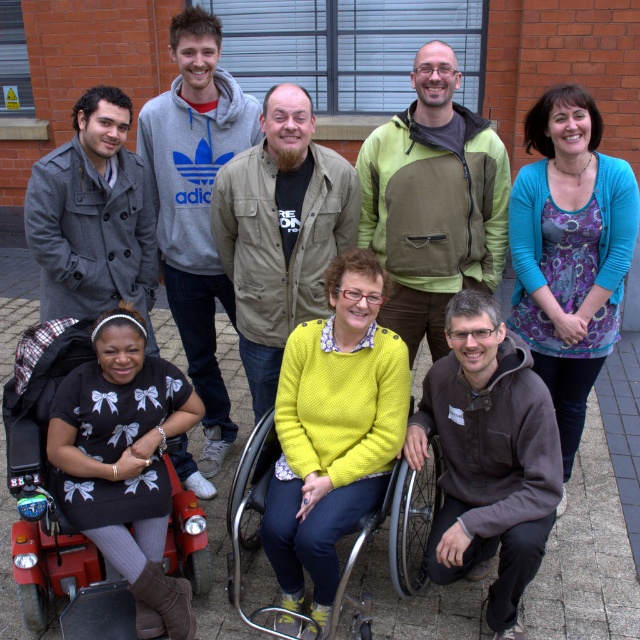
Question: Can you confirm if brown fleece at lower right is positioned below gray woolen coat at left?

Choices:
 (A) no
 (B) yes

Answer: (B)

Question: Which point is closer to the camera?

Choices:
 (A) green olive jacket at center
 (B) grey hoodie at upper left
 (C) knitted yellow sweater at center
 (D) gray woolen coat at left

Answer: (C)

Question: Which of the following is the closest to the observer?

Choices:
 (A) grey hoodie at upper left
 (B) red plastic wheelchair at lower left
 (C) floral-patterned sweater at center
 (D) green olive jacket at center

Answer: (B)

Question: Considering the real-world distances, which object is closest to the floral-patterned sweater at center?

Choices:
 (A) knitted yellow sweater at center
 (B) metallic silver wheelchair at center

Answer: (B)

Question: Is red plastic wheelchair at lower left smaller than khaki jacket at center?

Choices:
 (A) no
 (B) yes

Answer: (B)

Question: Is knitted yellow sweater at center smaller than red plastic wheelchair at lower left?

Choices:
 (A) no
 (B) yes

Answer: (B)